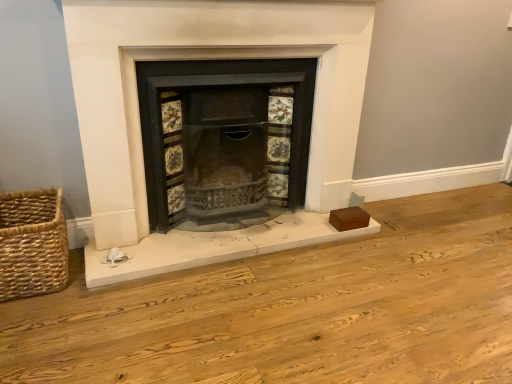
Question: Is woven straw basket at lower left located within black cast iron wood burning stove at center?

Choices:
 (A) no
 (B) yes

Answer: (A)

Question: From a real-world perspective, is black cast iron wood burning stove at center on top of woven straw basket at lower left?

Choices:
 (A) yes
 (B) no

Answer: (A)

Question: Does black cast iron wood burning stove at center have a larger size compared to woven straw basket at lower left?

Choices:
 (A) no
 (B) yes

Answer: (B)

Question: From the image's perspective, would you say black cast iron wood burning stove at center is shown under woven straw basket at lower left?

Choices:
 (A) yes
 (B) no

Answer: (B)

Question: Is black cast iron wood burning stove at center wider than woven straw basket at lower left?

Choices:
 (A) no
 (B) yes

Answer: (B)

Question: Considering the positions of point pos(321,44) and point pos(142,125), is point pos(321,44) closer or farther from the camera than point pos(142,125)?

Choices:
 (A) farther
 (B) closer

Answer: (A)

Question: Is matte black fireplace at center wider or thinner than black cast iron wood burning stove at center?

Choices:
 (A) wide
 (B) thin

Answer: (A)

Question: Choose the correct answer: Is matte black fireplace at center inside black cast iron wood burning stove at center or outside it?

Choices:
 (A) outside
 (B) inside

Answer: (A)

Question: From the image's perspective, is matte black fireplace at center above or below black cast iron wood burning stove at center?

Choices:
 (A) above
 (B) below

Answer: (A)

Question: Is woven straw basket at lower left bigger or smaller than black cast iron wood burning stove at center?

Choices:
 (A) small
 (B) big

Answer: (A)

Question: In terms of height, does woven straw basket at lower left look taller or shorter compared to black cast iron wood burning stove at center?

Choices:
 (A) tall
 (B) short

Answer: (B)

Question: Is point (16, 291) closer or farther from the camera than point (153, 61)?

Choices:
 (A) closer
 (B) farther

Answer: (A)

Question: In the image, is woven straw basket at lower left on the left side or the right side of black cast iron wood burning stove at center?

Choices:
 (A) right
 (B) left

Answer: (B)

Question: From a real-world perspective, is black cast iron wood burning stove at center above or below matte black fireplace at center?

Choices:
 (A) below
 (B) above

Answer: (A)

Question: Based on their sizes in the image, would you say black cast iron wood burning stove at center is bigger or smaller than matte black fireplace at center?

Choices:
 (A) big
 (B) small

Answer: (B)